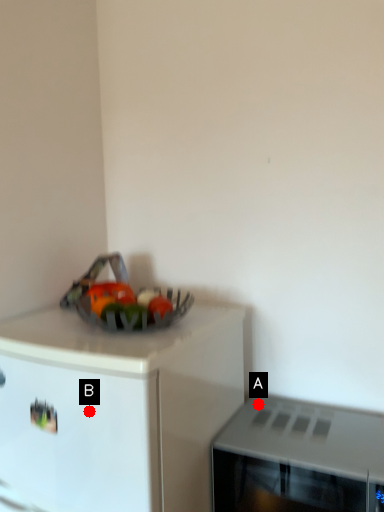
Question: Two points are circled on the image, labeled by A and B beside each circle. Which point is closer to the camera?

Choices:
 (A) A is closer
 (B) B is closer

Answer: (B)